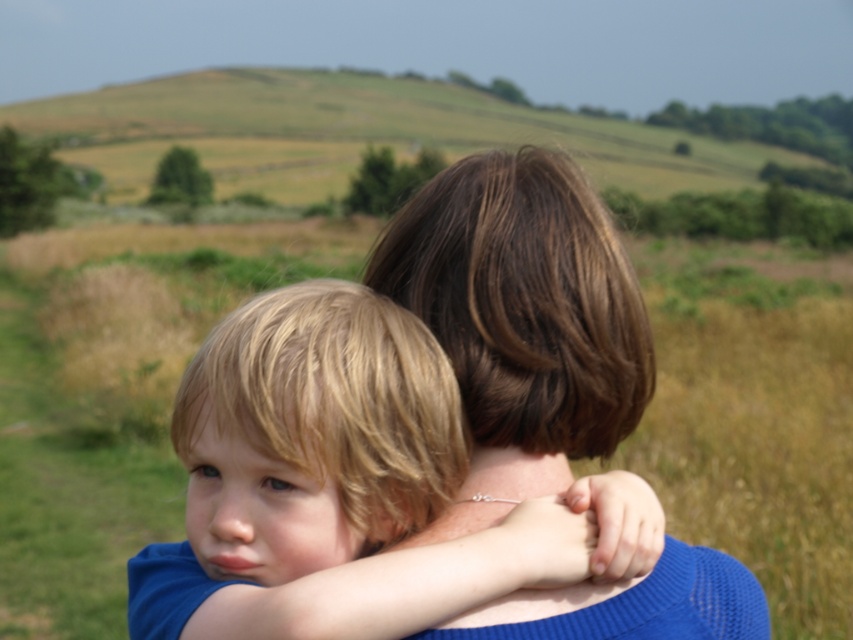
Can you confirm if blonde hair at center is positioned above brown hair at center?

No, blonde hair at center is not above brown hair at center.

Does blonde hair at center lie in front of brown hair at center?

Yes, blonde hair at center is closer to the viewer.

Who is more distant from viewer, (393,522) or (654,586)?

The point (654,586) is behind.

Locate an element on the screen. Image resolution: width=853 pixels, height=640 pixels. blonde hair at center is located at coordinates (341, 483).